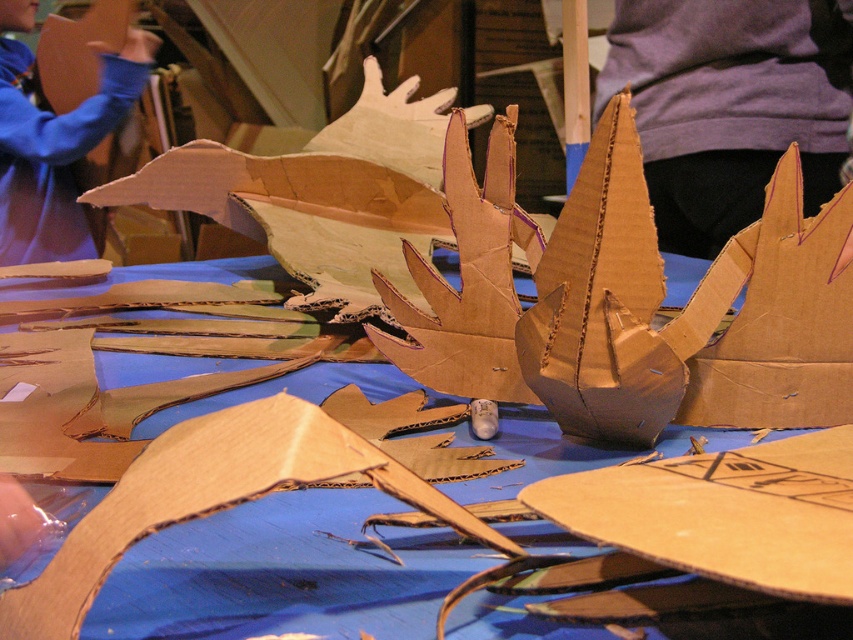
Is point (361, 396) more distant than point (107, 125)?

That is False.

Between point (531, 440) and point (28, 150), which one is positioned behind?

Positioned behind is point (28, 150).

Who is more forward, [218,381] or [122,83]?

Point [218,381]

What are the coordinates of `cardboard pieces at center` in the screenshot? It's located at (51, 404).

The width and height of the screenshot is (853, 640). I want to click on cardboard at center, so click(x=782, y=320).

Does cardboard at center have a greater height compared to matte blue sweatshirt at upper left?

No.

In order to click on cardboard at center in this screenshot , I will do `click(782, 320)`.

Between cardboard pieces at center and cardboard at center, which one has more height?

Standing taller between the two is cardboard pieces at center.

Does cardboard pieces at center have a smaller size compared to cardboard at center?

Actually, cardboard pieces at center might be larger than cardboard at center.

Locate an element on the screen. Image resolution: width=853 pixels, height=640 pixels. cardboard pieces at center is located at coordinates (51, 404).

Locate an element on the screen. The height and width of the screenshot is (640, 853). cardboard pieces at center is located at coordinates (51, 404).